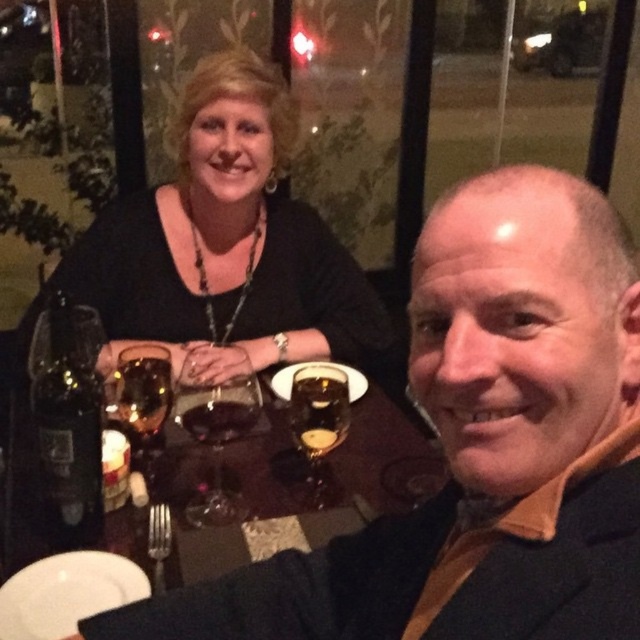
Question: Which point is closer to the camera?

Choices:
 (A) dark wood table at center
 (B) black matte necklace at upper left
 (C) translucent amber glass at center
 (D) translucent glass wine at center

Answer: (A)

Question: Is matte black suit at center positioned in front of translucent glass wine at center?

Choices:
 (A) no
 (B) yes

Answer: (B)

Question: From the image, what is the correct spatial relationship of translucent glass wine at center in relation to dark amber glass at center?

Choices:
 (A) left
 (B) right

Answer: (A)

Question: Which of the following is the closest to the observer?

Choices:
 (A) translucent glass wine at center
 (B) translucent glass at center
 (C) dark amber glass at center
 (D) dark wood table at center

Answer: (D)

Question: Which of the following is the closest to the observer?

Choices:
 (A) (280, 170)
 (B) (216, 410)

Answer: (B)

Question: Does translucent glass at center appear under translucent amber glass at center?

Choices:
 (A) no
 (B) yes

Answer: (B)